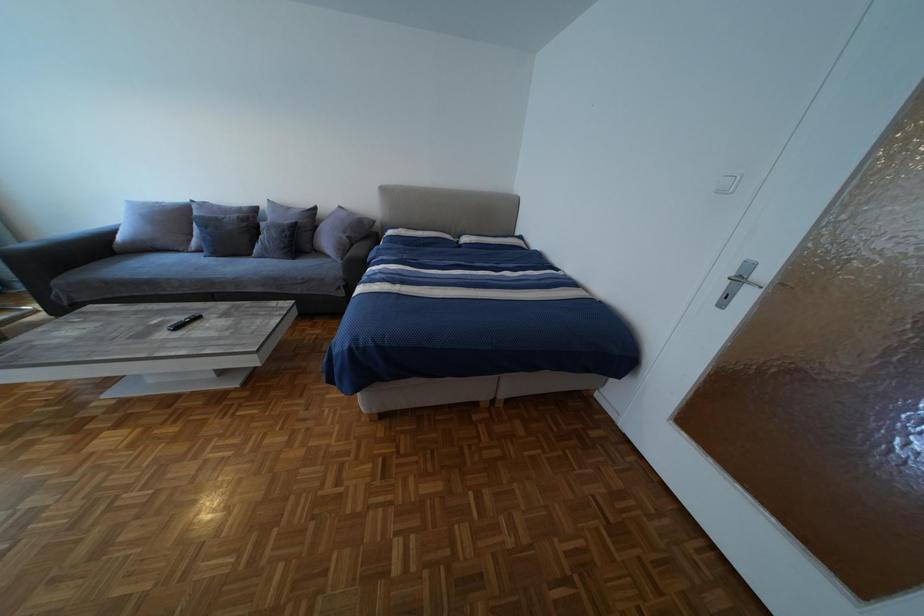
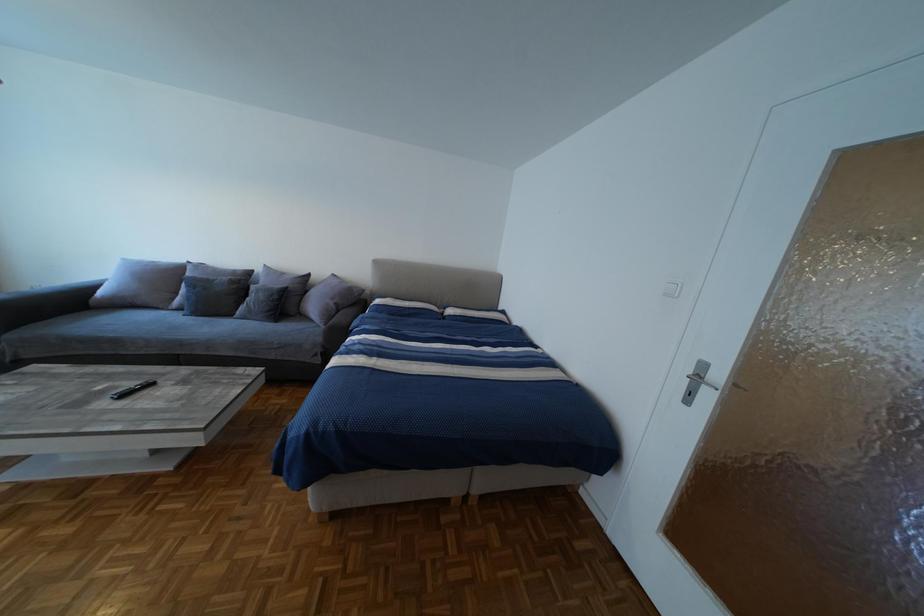
Which direction would the cameraman need to move to produce the second image?

The cameraman moved toward right, backward.